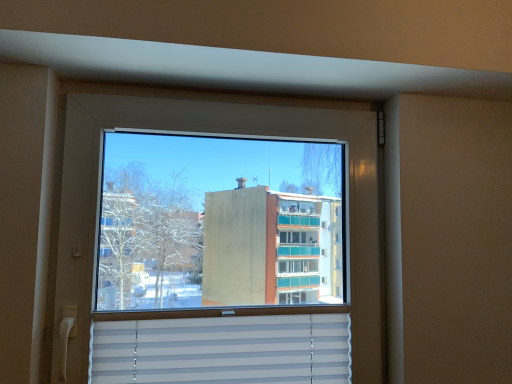
Question: Is transparent glass window at center facing towards white plastic blinds at bottom?

Choices:
 (A) no
 (B) yes

Answer: (B)

Question: From the image's perspective, is transparent glass window at center on white plastic blinds at bottom?

Choices:
 (A) no
 (B) yes

Answer: (B)

Question: Is transparent glass window at center smaller than white plastic blinds at bottom?

Choices:
 (A) yes
 (B) no

Answer: (B)

Question: Is transparent glass window at center next to white plastic blinds at bottom?

Choices:
 (A) no
 (B) yes

Answer: (A)

Question: Is the position of transparent glass window at center more distant than that of white plastic blinds at bottom?

Choices:
 (A) no
 (B) yes

Answer: (A)

Question: Can you confirm if transparent glass window at center is positioned to the right of white plastic blinds at bottom?

Choices:
 (A) yes
 (B) no

Answer: (A)

Question: From a real-world perspective, is white plastic blinds at bottom below transparent glass window at center?

Choices:
 (A) yes
 (B) no

Answer: (A)

Question: Would you say transparent glass window at center is part of white plastic blinds at bottom's contents?

Choices:
 (A) no
 (B) yes

Answer: (A)

Question: Is the position of white plastic blinds at bottom less distant than that of transparent glass window at center?

Choices:
 (A) no
 (B) yes

Answer: (A)

Question: Could you tell me if white plastic blinds at bottom is turned towards transparent glass window at center?

Choices:
 (A) yes
 (B) no

Answer: (A)

Question: Can you confirm if white plastic blinds at bottom is wider than transparent glass window at center?

Choices:
 (A) yes
 (B) no

Answer: (B)

Question: Is white plastic blinds at bottom positioned beyond the bounds of transparent glass window at center?

Choices:
 (A) no
 (B) yes

Answer: (A)

Question: Is transparent glass window at center inside or outside of white plastic blinds at bottom?

Choices:
 (A) inside
 (B) outside

Answer: (B)